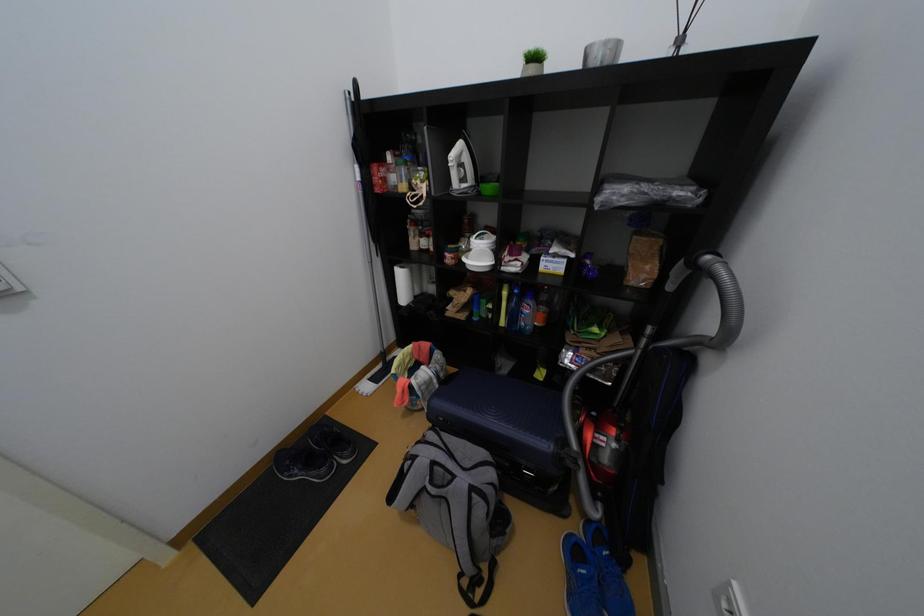
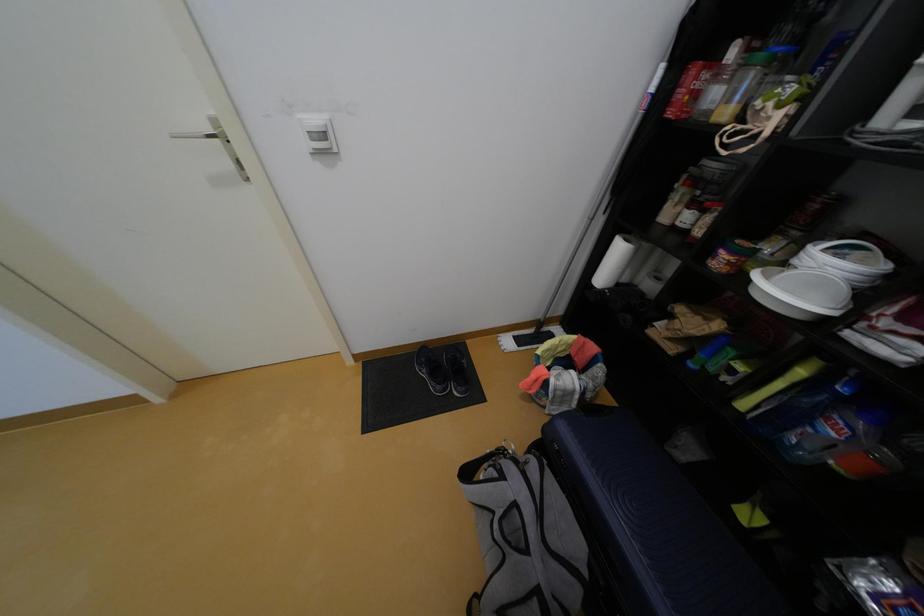
The first image is from the beginning of the video and the second image is from the end. How did the camera likely rotate when shooting the video?

The camera's rotation is toward left-down.